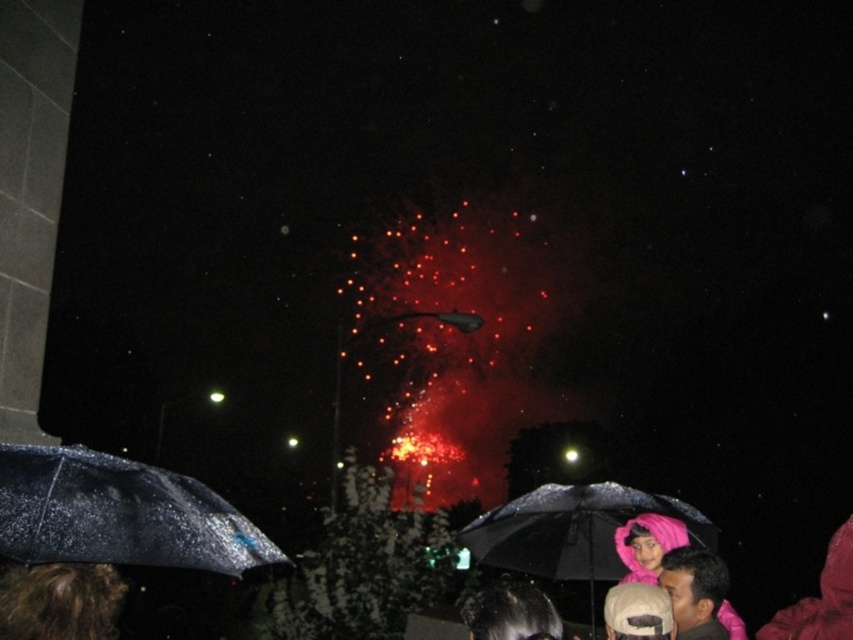
Question: Among these objects, which one is nearest to the camera?

Choices:
 (A) transparent wet umbrella at lower left
 (B) brown curly hair at lower left
 (C) black matte umbrella at lower center

Answer: (A)

Question: Does transparent wet umbrella at lower left appear over brown curly hair at lower left?

Choices:
 (A) no
 (B) yes

Answer: (B)

Question: Estimate the real-world distances between objects in this image. Which object is closer to the black matte umbrella at lower center?

Choices:
 (A) brown curly hair at lower left
 (B) transparent wet umbrella at lower left

Answer: (B)

Question: Which point is farther from the camera taking this photo?

Choices:
 (A) (39, 625)
 (B) (543, 525)

Answer: (B)

Question: Does black matte umbrella at lower center appear on the left side of brown curly hair at lower left?

Choices:
 (A) no
 (B) yes

Answer: (A)

Question: Can you confirm if black matte umbrella at lower center is wider than brown curly hair at lower left?

Choices:
 (A) yes
 (B) no

Answer: (B)